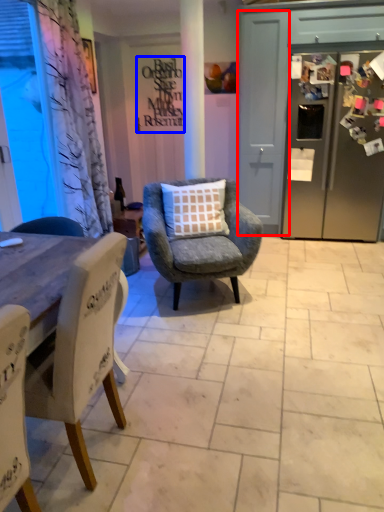
Question: Among these objects, which one is nearest to the camera, screen door (highlighted by a red box) or writing (highlighted by a blue box)?

Choices:
 (A) screen door
 (B) writing

Answer: (A)